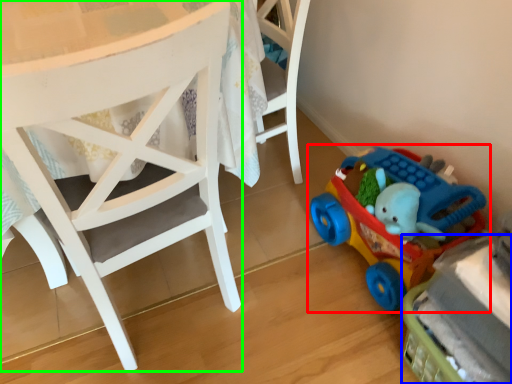
Question: Estimate the real-world distances between objects in this image. Which object is farther from toy (highlighted by a red box), toy (highlighted by a blue box) or chair (highlighted by a green box)?

Choices:
 (A) toy
 (B) chair

Answer: (B)